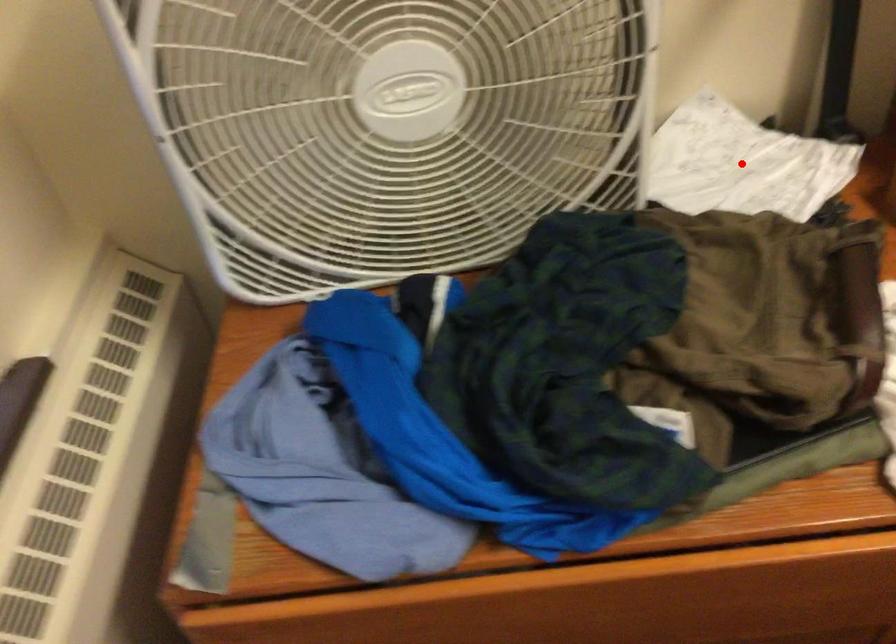
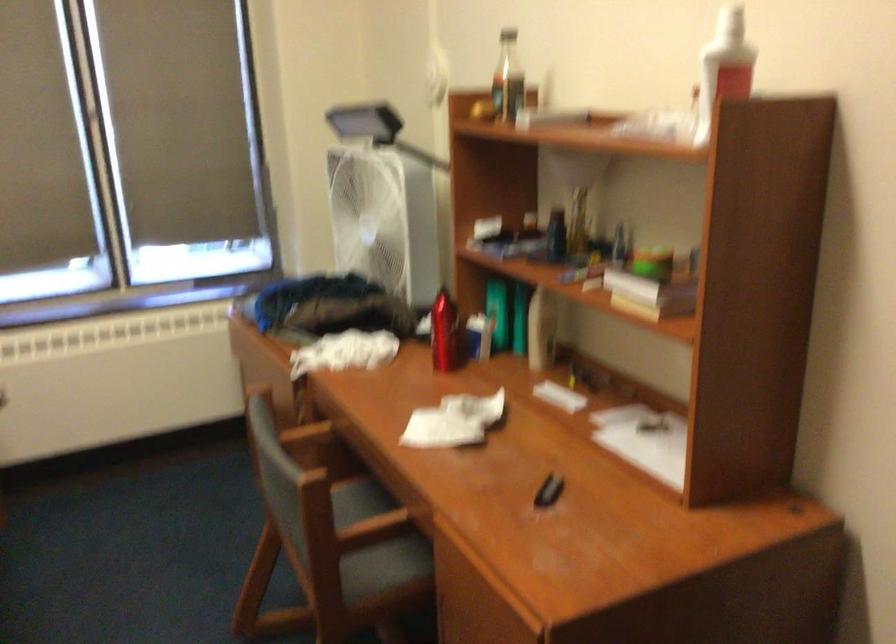
Question: I am providing you with two images of the same scene from different viewpoints. A red point is marked on the first image. At the location where the point appears in image 1, is it still visible in image 2?

Choices:
 (A) Yes
 (B) No

Answer: (B)